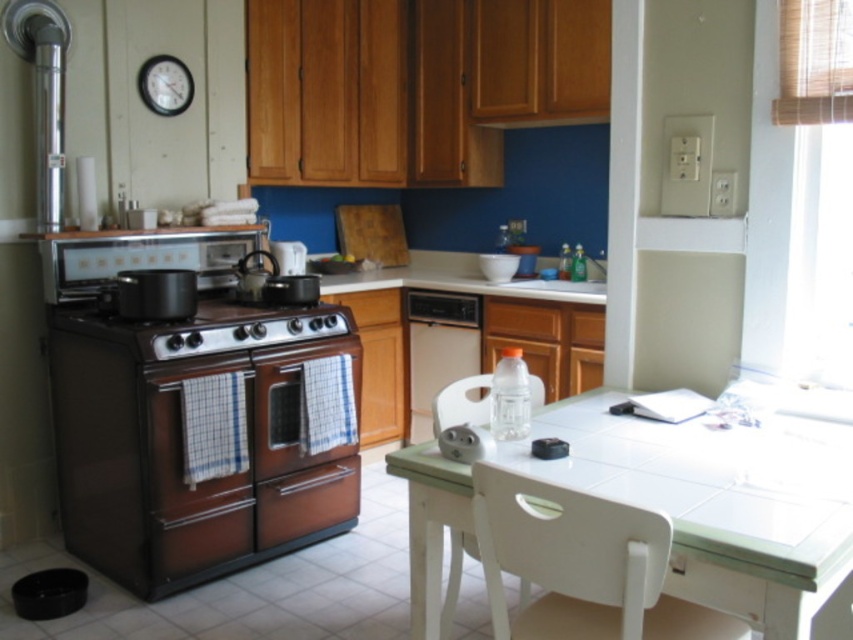
Question: Which of the following is the farthest from the observer?

Choices:
 (A) white tile table at lower right
 (B) brown glossy gas stove at center-left
 (C) satin white dishwasher at center
 (D) white glossy countertop at center

Answer: (C)

Question: Considering the relative positions of white tile table at lower right and white glossy countertop at center in the image provided, where is white tile table at lower right located with respect to white glossy countertop at center?

Choices:
 (A) right
 (B) left

Answer: (A)

Question: Is brown glossy oven at left smaller than white tile table at lower right?

Choices:
 (A) yes
 (B) no

Answer: (B)

Question: Is white tile table at lower right positioned at the back of satin white dishwasher at center?

Choices:
 (A) yes
 (B) no

Answer: (B)

Question: Which object appears closest to the camera in this image?

Choices:
 (A) satin white dishwasher at center
 (B) white glossy countertop at center
 (C) brown glossy oven at left
 (D) white tile table at lower right

Answer: (D)

Question: Which point is farther from the camera taking this photo?

Choices:
 (A) (267, 435)
 (B) (584, 428)
 (C) (294, 337)
 (D) (410, 390)

Answer: (D)